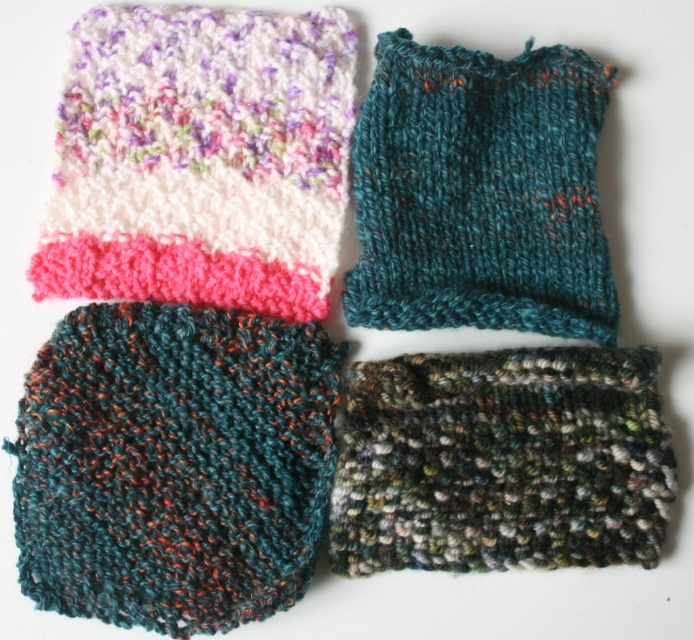
Based on the photo, you are a knitter who wants to place both the multicolored knitted sock at upper left and the multicolored yarn sock at bottom right into a drawer. The drawer has a height limit of 12 inches. Can both items fit vertically without bending them? Please explain based on their heights.

The multicolored knitted sock at upper left is much taller than the multicolored yarn sock at bottom right. Since the drawer has a 12 inch height limit, only the shorter multicolored yarn sock at bottom right can fit vertically. The taller multicolored knitted sock at upper left would exceed the drawer height and cannot be placed without bending.

You are organizing a sock drawer and have two socks to place. The multicolored yarn sock at bottom right and the teal knitted sock at upper right. Which sock is shorter in height?

The multicolored yarn sock at bottom right has a lesser height compared to the teal knitted sock at upper right, so the multicolored yarn sock at bottom right is shorter in height.

Based on the photo, you are a knitter who wants to create a matching pair of socks using the patterns from the image. Which sock pattern should you choose between the multicolored knitted sock at upper left and the multicolored yarn sock at bottom right if you want the finished socks to be wider?

The multicolored yarn sock at bottom right is wider than the multicolored knitted sock at upper left, so you should choose the multicolored yarn sock at bottom right to create wider socks.